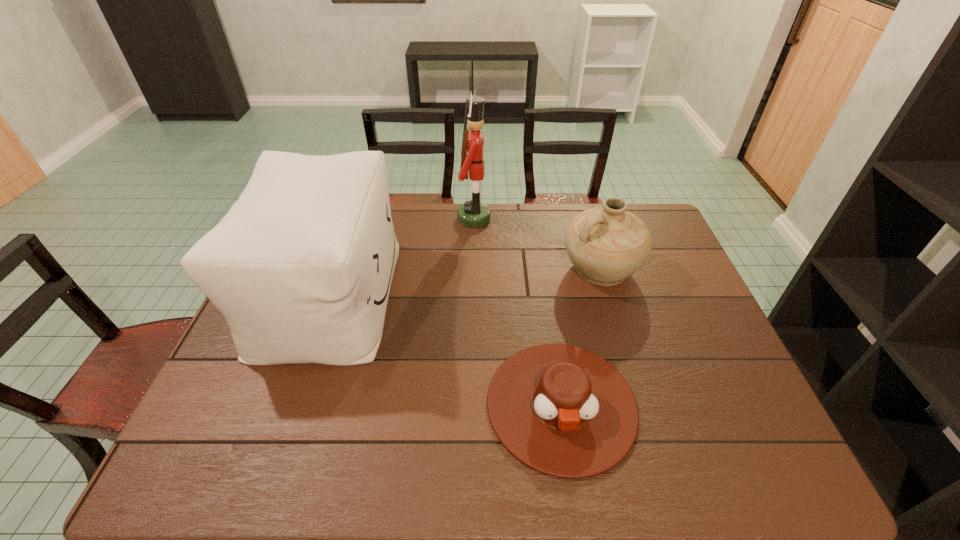
Where is `the second closest object relative to the cushion`? The image size is (960, 540). the second closest object relative to the cushion is located at coordinates (561, 410).

You are a GUI agent. You are given a task and a screenshot of the screen. Output one action in this format:
    pyautogui.click(x=<x>, y=<y>)
    Task: Click on the free region that satisfies the following two spatial constraints: 1. on the front side of the pottery; 2. on the side of the second tallest object with the smiley face
    This screenshot has height=540, width=960.
    Given the screenshot: What is the action you would take?
    pyautogui.click(x=609, y=295)

The image size is (960, 540). Identify the location of vacant space that satisfies the following two spatial constraints: 1. on the front side of the second shortest object; 2. on the side of the second tallest object with the smiley face. (609, 295).

Locate an element on the screen. free spot that satisfies the following two spatial constraints: 1. on the front-facing side of the second shortest object; 2. on the right side of the farthest object is located at coordinates (473, 269).